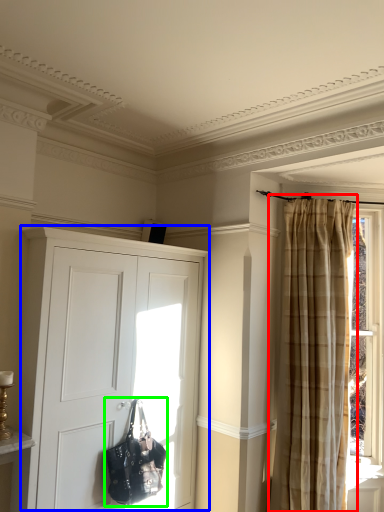
Question: Which object is the farthest from curtain (highlighted by a red box)? Choose among these: cupboard (highlighted by a blue box) or handbag (highlighted by a green box).

Choices:
 (A) cupboard
 (B) handbag

Answer: (B)